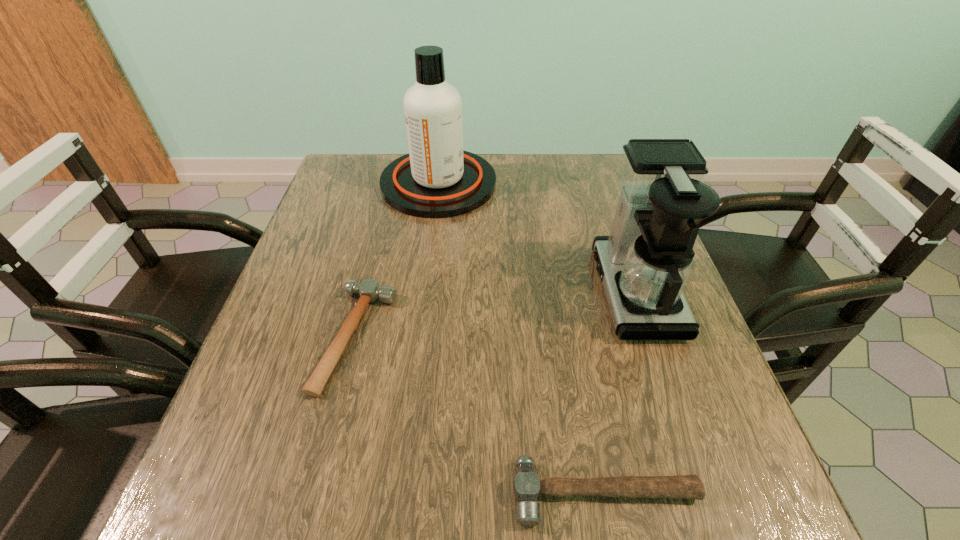
At what (x,y) coordinates should I click in order to perform the action: click on vacant space situated on the right of the farther hammer. Please return your answer as a coordinate pair (x, y). This screenshot has height=540, width=960. Looking at the image, I should click on (562, 338).

Find the location of a particular element. The image size is (960, 540). object positioned at the far edge is located at coordinates (437, 179).

Find the location of `object located in the near edge section of the desktop`. object located in the near edge section of the desktop is located at coordinates [x=526, y=486].

Locate an element on the screen. cleansing agent that is positioned at the left edge is located at coordinates (437, 179).

The image size is (960, 540). In order to click on hammer present at the left edge in this screenshot , I will do `click(370, 291)`.

I want to click on coffee maker that is positioned at the right edge, so click(645, 263).

Where is `hammer located in the right edge section of the desktop`? The height and width of the screenshot is (540, 960). hammer located in the right edge section of the desktop is located at coordinates (526, 486).

I want to click on object present at the far left corner, so click(x=437, y=179).

Where is `object located in the near right corner section of the desktop`? object located in the near right corner section of the desktop is located at coordinates (526, 486).

At what (x,y) coordinates should I click in order to perform the action: click on vacant position at the far edge of the desktop. Please return your answer as a coordinate pair (x, y). Image resolution: width=960 pixels, height=540 pixels. Looking at the image, I should click on (561, 154).